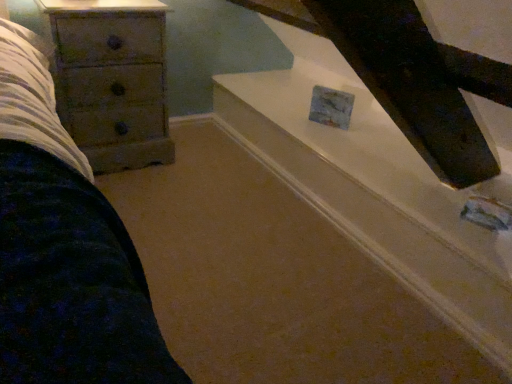
Where is `vacant area that lies to the right of wooden chest of drawers at left`? The width and height of the screenshot is (512, 384). vacant area that lies to the right of wooden chest of drawers at left is located at coordinates (196, 175).